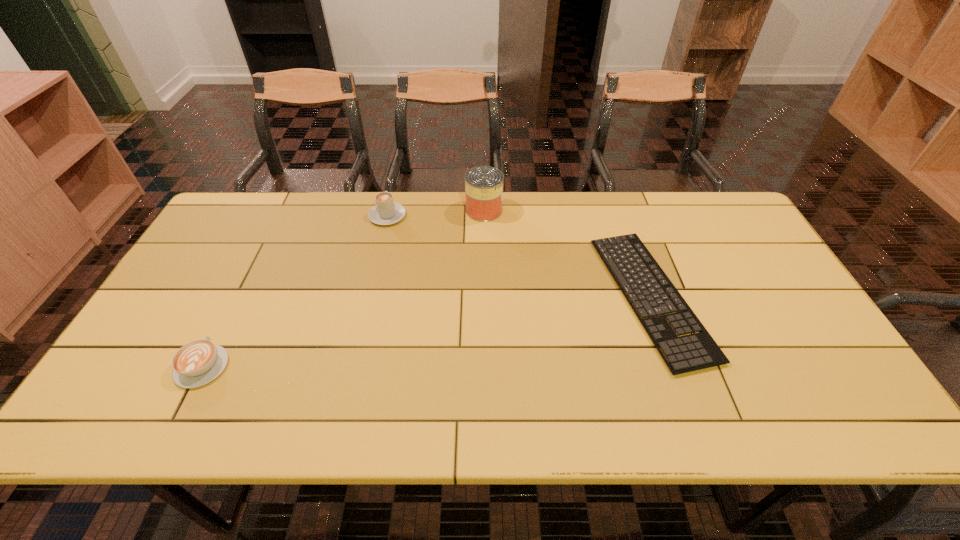
The height and width of the screenshot is (540, 960). I want to click on vacant area situated on the side of the second shortest object with the handle, so click(x=252, y=269).

The width and height of the screenshot is (960, 540). What are the coordinates of `free space located on the side of the second shortest object with the handle` in the screenshot? It's located at (237, 298).

The width and height of the screenshot is (960, 540). Identify the location of free location located on the side of the second shortest object with the handle. (260, 252).

Image resolution: width=960 pixels, height=540 pixels. I want to click on free spot located 0.050m on the front of the shortest object, so click(686, 397).

In order to click on can that is at the far edge in this screenshot , I will do `click(483, 185)`.

I want to click on cappuccino located in the far edge section of the desktop, so click(x=386, y=212).

Find the location of a particular element. computer keyboard at the far edge is located at coordinates (696, 351).

Identify the location of object present at the left edge. Image resolution: width=960 pixels, height=540 pixels. (197, 363).

The height and width of the screenshot is (540, 960). In the image, there is a desktop. In order to click on vacant space at the far edge in this screenshot , I will do `click(328, 192)`.

Image resolution: width=960 pixels, height=540 pixels. Identify the location of vacant space at the near edge. (769, 393).